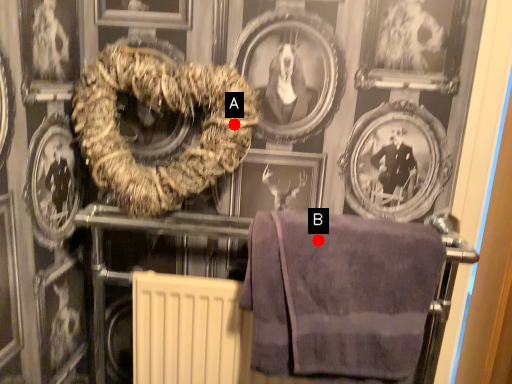
Question: Two points are circled on the image, labeled by A and B beside each circle. Among these points, which one is nearest to the camera?

Choices:
 (A) A is closer
 (B) B is closer

Answer: (B)